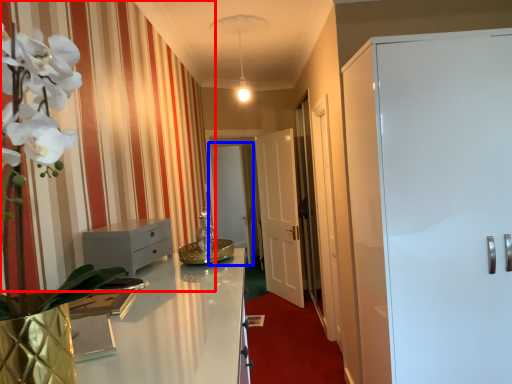
Question: Which object is closer to the camera taking this photo, curtain (highlighted by a red box) or glass door (highlighted by a blue box)?

Choices:
 (A) curtain
 (B) glass door

Answer: (A)